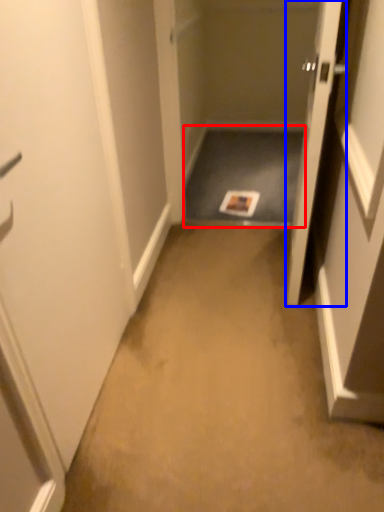
Question: Which object appears closest to the camera in this image, corridor (highlighted by a red box) or door (highlighted by a blue box)?

Choices:
 (A) corridor
 (B) door

Answer: (B)